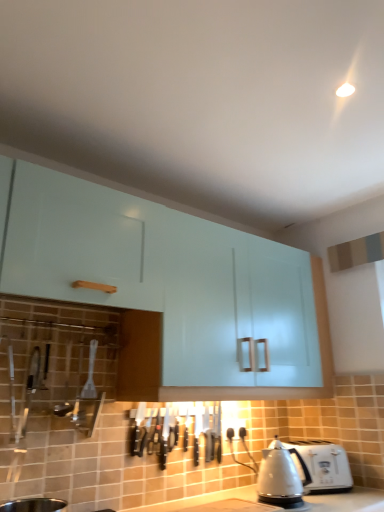
This screenshot has width=384, height=512. What do you see at coordinates (279, 478) in the screenshot? I see `satin silver kettle at lower right` at bounding box center [279, 478].

What is the approximate width of white plastic toaster at lower right?

The width of white plastic toaster at lower right is 8.72 inches.

The height and width of the screenshot is (512, 384). Identify the location of glossy white cabinet at upper center. (175, 283).

Is white plastic toaster at lower right oriented towards glossy white cabinet at upper center?

No, white plastic toaster at lower right does not turn towards glossy white cabinet at upper center.

From the image's perspective, which is below, white plastic toaster at lower right or glossy white cabinet at upper center?

white plastic toaster at lower right is shown below in the image.

Is glossy white cabinet at upper center located within white plastic toaster at lower right?

No.

Between white plastic toaster at lower right and glossy white cabinet at upper center, which one has more height?

glossy white cabinet at upper center.

Is white plastic toaster at lower right surrounded by satin silver kettle at lower right?

No, satin silver kettle at lower right does not contain white plastic toaster at lower right.

Are satin silver kettle at lower right and white plastic toaster at lower right far apart?

No.

The image size is (384, 512). I want to click on kettle above the white plastic toaster at lower right (from the image's perspective), so click(x=279, y=478).

Between point (261, 501) and point (330, 484), which one is positioned behind?

The point (330, 484) is farther.

How different are the orientations of glossy white cabinet at upper center and white plastic toaster at lower right in degrees?

31.6 degrees separate the facing orientations of glossy white cabinet at upper center and white plastic toaster at lower right.

From a real-world perspective, relative to white plastic toaster at lower right, is glossy white cabinet at upper center vertically above or below?

In terms of real-world spatial position, glossy white cabinet at upper center is above white plastic toaster at lower right.

From the image's perspective, which is above, glossy white cabinet at upper center or white plastic toaster at lower right?

From the image's view, glossy white cabinet at upper center is above.

Is glossy white cabinet at upper center oriented away from white plastic toaster at lower right?

No, white plastic toaster at lower right is not at the back of glossy white cabinet at upper center.

Is glossy white cabinet at upper center turned away from satin silver kettle at lower right?

glossy white cabinet at upper center is not turned away from satin silver kettle at lower right.

Between glossy white cabinet at upper center and satin silver kettle at lower right, which one has less height?

satin silver kettle at lower right.

From the image's perspective, is glossy white cabinet at upper center located above or below satin silver kettle at lower right?

From the image's perspective, glossy white cabinet at upper center appears above satin silver kettle at lower right.

Locate an element on the screen. This screenshot has height=512, width=384. kettle below the glossy white cabinet at upper center (from a real-world perspective) is located at coordinates (279, 478).

Considering the relative positions of satin silver kettle at lower right and glossy white cabinet at upper center in the image provided, is satin silver kettle at lower right to the left of glossy white cabinet at upper center from the viewer's perspective?

No, satin silver kettle at lower right is not to the left of glossy white cabinet at upper center.

From a real-world perspective, between satin silver kettle at lower right and glossy white cabinet at upper center, who is vertically higher?

glossy white cabinet at upper center is physically above.

How distant is satin silver kettle at lower right from glossy white cabinet at upper center?

66.94 centimeters.

Is satin silver kettle at lower right behind glossy white cabinet at upper center?

Yes.

From the image's perspective, between white plastic toaster at lower right and satin silver kettle at lower right, who is located below?

From the image's view, white plastic toaster at lower right is below.

Can you confirm if white plastic toaster at lower right is bigger than satin silver kettle at lower right?

Yes.

From a real-world perspective, is white plastic toaster at lower right physically located above or below satin silver kettle at lower right?

Clearly, from a real-world perspective, white plastic toaster at lower right is below satin silver kettle at lower right.

Where is `toaster on the right side of glossy white cabinet at upper center`? This screenshot has width=384, height=512. toaster on the right side of glossy white cabinet at upper center is located at coordinates (320, 465).

Locate an element on the screen. This screenshot has height=512, width=384. toaster below the satin silver kettle at lower right (from the image's perspective) is located at coordinates (320, 465).

Based on their spatial positions, is satin silver kettle at lower right or glossy white cabinet at upper center closer to white plastic toaster at lower right?

satin silver kettle at lower right is closer to white plastic toaster at lower right.

Which object lies nearer to the anchor point glossy white cabinet at upper center, satin silver kettle at lower right or white plastic toaster at lower right?

white plastic toaster at lower right.

Looking at the image, which one is located closer to satin silver kettle at lower right, glossy white cabinet at upper center or white plastic toaster at lower right?

Among the two, white plastic toaster at lower right is located nearer to satin silver kettle at lower right.

Considering their positions, is glossy white cabinet at upper center positioned further to white plastic toaster at lower right than satin silver kettle at lower right?

The object further to white plastic toaster at lower right is glossy white cabinet at upper center.

Based on their spatial positions, is white plastic toaster at lower right or satin silver kettle at lower right closer to glossy white cabinet at upper center?

white plastic toaster at lower right lies closer to glossy white cabinet at upper center than the other object.

Based on their spatial positions, is white plastic toaster at lower right or glossy white cabinet at upper center further from satin silver kettle at lower right?

The object further to satin silver kettle at lower right is glossy white cabinet at upper center.

What are the coordinates of `kettle between glossy white cabinet at upper center and white plastic toaster at lower right in the up-down direction` in the screenshot? It's located at (279, 478).